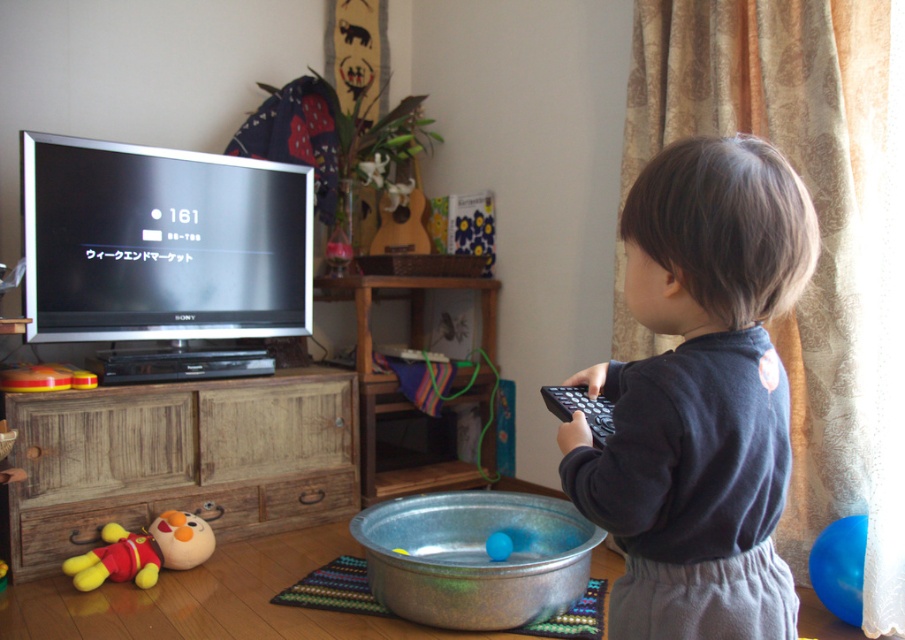
Question: Does yellow plush toy at lower left have a greater width compared to metallic blue bowl at lower center?

Choices:
 (A) yes
 (B) no

Answer: (A)

Question: Does dark blue fleece at center appear over metallic blue bowl at lower center?

Choices:
 (A) yes
 (B) no

Answer: (A)

Question: Which point is farther to the camera?

Choices:
 (A) (491, 541)
 (B) (220, 428)

Answer: (B)

Question: Which point is closer to the camera taking this photo?

Choices:
 (A) (489, 544)
 (B) (131, 454)

Answer: (A)

Question: Can you confirm if wooden cabinet at lower left is positioned below metallic blue bowl at lower center?

Choices:
 (A) no
 (B) yes

Answer: (A)

Question: Which of the following is the farthest from the observer?

Choices:
 (A) black matte remote at right
 (B) yellow plush toy at lower left
 (C) metallic blue bowl at lower center
 (D) dark blue fleece at center

Answer: (C)